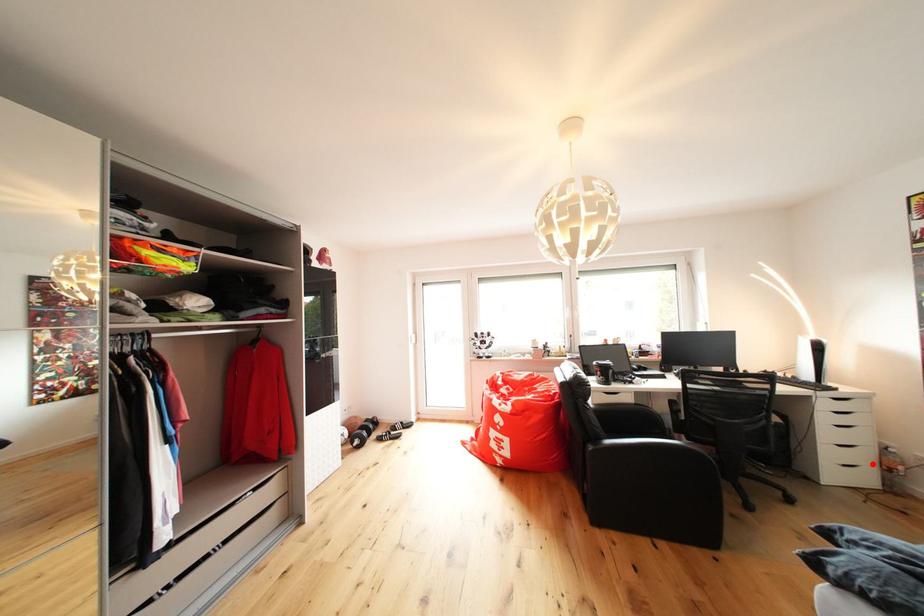
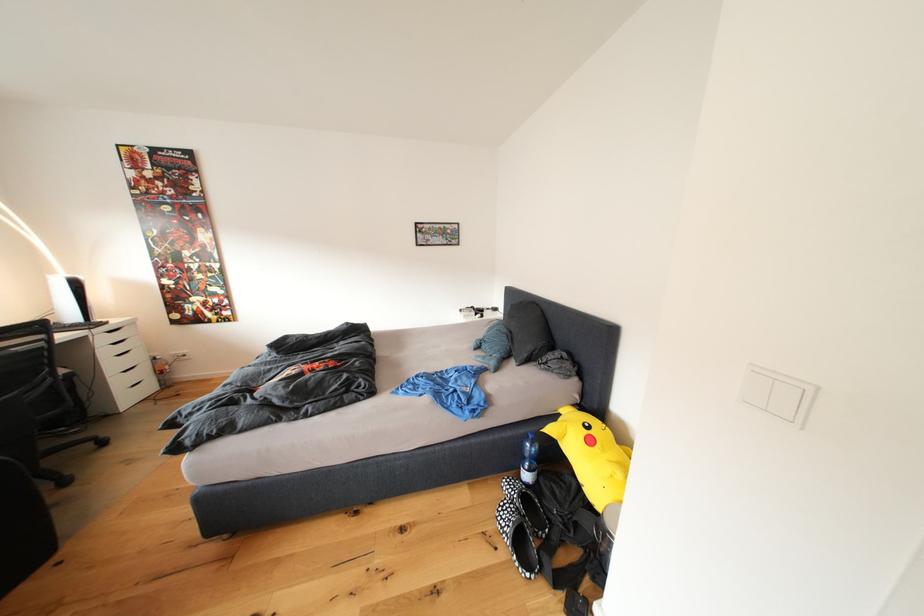
Question: I am providing you with two images of the same scene from different viewpoints. A red point is shown in image1. For the corresponding object point in image2, is it positioned nearer or farther from the camera?

Choices:
 (A) Nearer
 (B) Farther

Answer: (A)